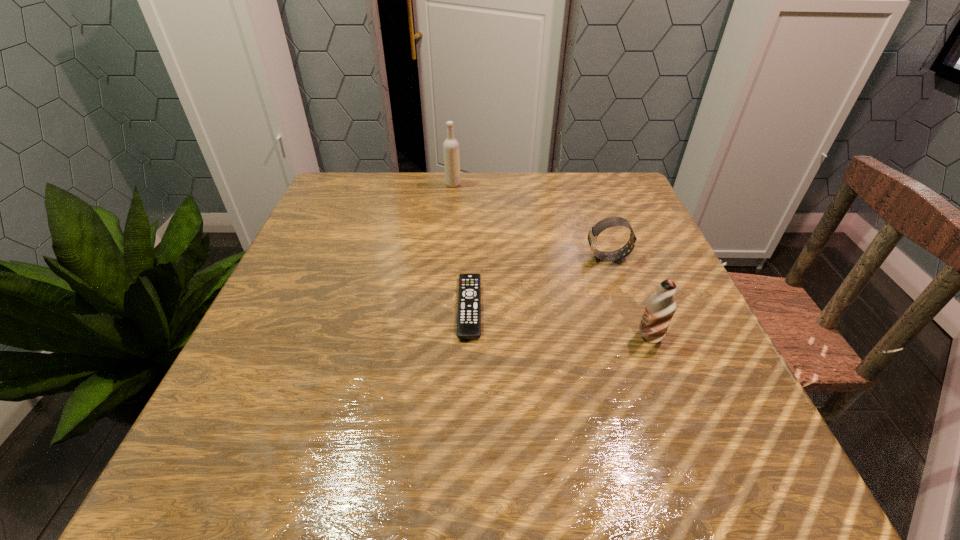
Identify the location of vodka. The width and height of the screenshot is (960, 540). (450, 146).

Locate an element on the screen. the farthest object is located at coordinates (450, 146).

This screenshot has height=540, width=960. In order to click on the third shortest object in this screenshot , I will do pyautogui.click(x=660, y=307).

Find the location of a particular element. This screenshot has width=960, height=540. the second shortest object is located at coordinates (606, 223).

What are the coordinates of `watch` in the screenshot? It's located at (606, 223).

Locate an element on the screen. the second object from left to right is located at coordinates (469, 296).

Identify the location of the shortest object. This screenshot has width=960, height=540. (469, 296).

The image size is (960, 540). I want to click on free location located on the left of the vodka, so (x=405, y=185).

Where is `free space located on the back of the chocolate milk`? Image resolution: width=960 pixels, height=540 pixels. free space located on the back of the chocolate milk is located at coordinates (633, 291).

I want to click on vacant region located on the face of the third tallest object, so click(x=412, y=258).